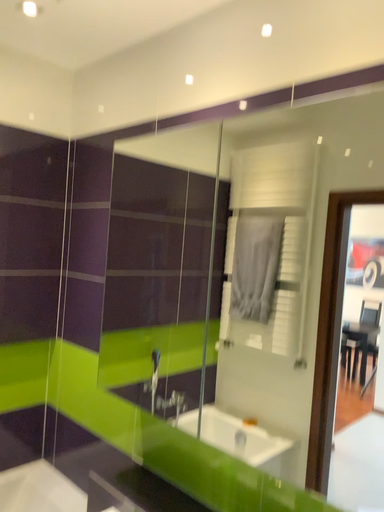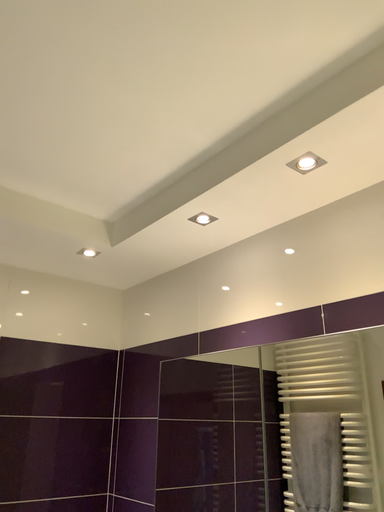
Question: Which way did the camera rotate in the video?

Choices:
 (A) rotated upward
 (B) rotated downward

Answer: (A)